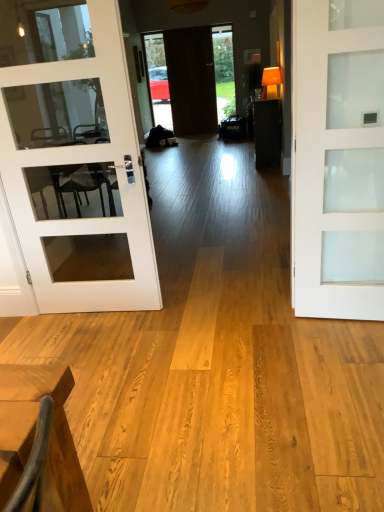
Question: Choose the correct answer: Is white frosted glass door at center, positioned as the first door in front-to-back order, inside dark wood table at center or outside it?

Choices:
 (A) inside
 (B) outside

Answer: (B)

Question: Considering the positions of white frosted glass door at center, the third door from the back, and dark wood table at center in the image, is white frosted glass door at center, the third door from the back, bigger or smaller than dark wood table at center?

Choices:
 (A) small
 (B) big

Answer: (A)

Question: Which of these objects is positioned farthest from the dark wood door at center, positioned as the second door in left-to-right order?

Choices:
 (A) white frosted glass door at center, placed as the third door when sorted from top to bottom
 (B) white glass door at left, acting as the 2th door starting from the back
 (C) dark wood table at center
 (D) clear glass door at center

Answer: (A)

Question: Which object is the closest to the clear glass door at center?

Choices:
 (A) white glass door at left, acting as the 2th door starting from the back
 (B) dark wood table at center
 (C) white frosted glass door at center, the third door from the back
 (D) dark wood door at center, positioned as the second door in left-to-right order

Answer: (D)